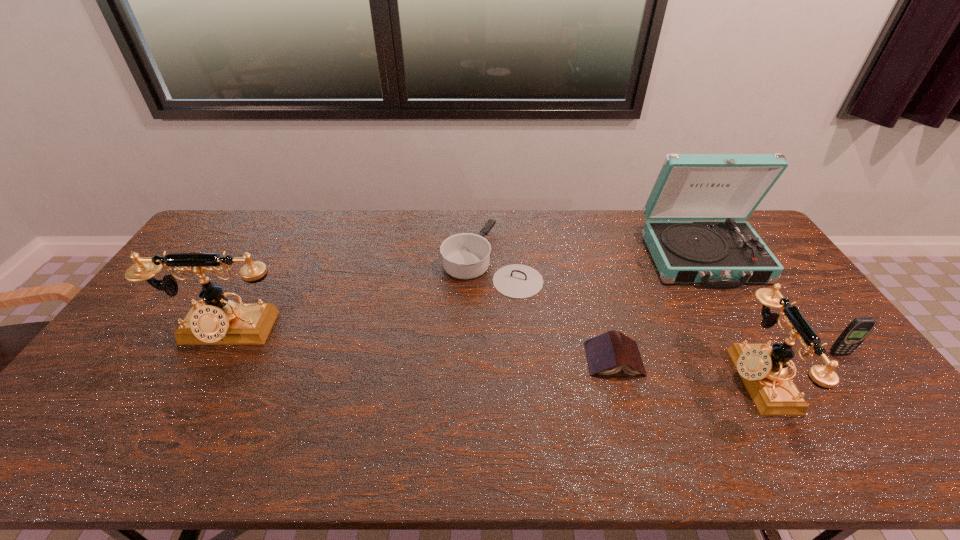
Identify which object is located as the second nearest to the rightmost object. Please provide its 2D coordinates. Your answer should be formatted as a tuple, i.e. [(x, y)], where the tuple contains the x and y coordinates of a point satisfying the conditions above.

[(718, 254)]

This screenshot has height=540, width=960. Identify the location of vacant space that satisfies the following two spatial constraints: 1. on the face side of the tallest object; 2. on the dial of the right telephone. (x=774, y=379).

At what (x,y) coordinates should I click in order to perform the action: click on vacant space that satisfies the following two spatial constraints: 1. on the screen of the rightmost object; 2. on the dial of the third tallest object. Please return your answer as a coordinate pair (x, y). Image resolution: width=960 pixels, height=540 pixels. Looking at the image, I should click on (857, 379).

Where is `vacant space that satisfies the following two spatial constraints: 1. on the screen of the cellular telephone; 2. on the dial of the shorter telephone`? vacant space that satisfies the following two spatial constraints: 1. on the screen of the cellular telephone; 2. on the dial of the shorter telephone is located at coordinates (857, 379).

Image resolution: width=960 pixels, height=540 pixels. What are the coordinates of `free space that satisfies the following two spatial constraints: 1. on the screen of the rightmost object; 2. on the dial of the shorter telephone` in the screenshot? It's located at (857, 379).